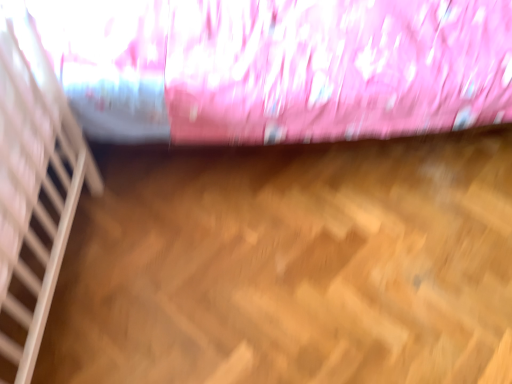
Question: Can we say white wooden stairwell at left lies outside pink satin curtain at upper center?

Choices:
 (A) yes
 (B) no

Answer: (A)

Question: From a real-world perspective, is white wooden stairwell at left positioned over pink satin curtain at upper center based on gravity?

Choices:
 (A) no
 (B) yes

Answer: (B)

Question: Can you confirm if white wooden stairwell at left is taller than pink satin curtain at upper center?

Choices:
 (A) yes
 (B) no

Answer: (B)

Question: Is white wooden stairwell at left far away from pink satin curtain at upper center?

Choices:
 (A) no
 (B) yes

Answer: (A)

Question: Can you confirm if white wooden stairwell at left is wider than pink satin curtain at upper center?

Choices:
 (A) yes
 (B) no

Answer: (B)

Question: Is white wooden stairwell at left at the right side of pink satin curtain at upper center?

Choices:
 (A) yes
 (B) no

Answer: (B)

Question: From the image's perspective, does pink satin curtain at upper center appear lower than white wooden stairwell at left?

Choices:
 (A) no
 (B) yes

Answer: (A)

Question: From a real-world perspective, is pink satin curtain at upper center over white wooden stairwell at left?

Choices:
 (A) no
 (B) yes

Answer: (A)

Question: Considering the relative sizes of pink satin curtain at upper center and white wooden stairwell at left in the image provided, is pink satin curtain at upper center thinner than white wooden stairwell at left?

Choices:
 (A) yes
 (B) no

Answer: (B)

Question: From a real-world perspective, is pink satin curtain at upper center positioned under white wooden stairwell at left based on gravity?

Choices:
 (A) yes
 (B) no

Answer: (A)

Question: Does pink satin curtain at upper center appear on the right side of white wooden stairwell at left?

Choices:
 (A) no
 (B) yes

Answer: (B)

Question: Is pink satin curtain at upper center taller than white wooden stairwell at left?

Choices:
 (A) no
 (B) yes

Answer: (B)

Question: Considering the positions of pink satin curtain at upper center and white wooden stairwell at left in the image, is pink satin curtain at upper center bigger or smaller than white wooden stairwell at left?

Choices:
 (A) small
 (B) big

Answer: (B)